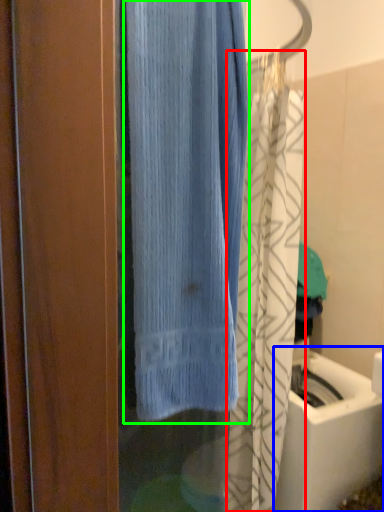
Question: Estimate the real-world distances between objects in this image. Which object is farther from shower curtain (highlighted by a red box), sink (highlighted by a blue box) or curtain (highlighted by a green box)?

Choices:
 (A) sink
 (B) curtain

Answer: (B)